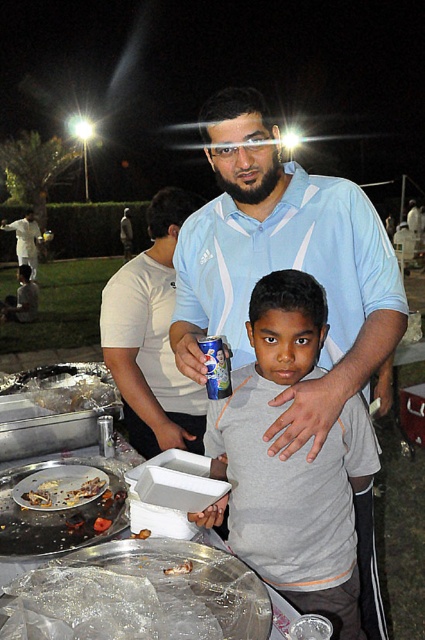
Question: Based on their relative distances, which object is farther from the gray matte shirt at center?

Choices:
 (A) matte white shirt at center
 (B) matte black laptop at left

Answer: (B)

Question: Which of these objects is positioned closest to the matte white shirt at center?

Choices:
 (A) matte black laptop at left
 (B) brown crispy chicken at lower left
 (C) gray matte shirt at center

Answer: (B)

Question: Where is gray matte shirt at center located in relation to matte white shirt at center in the image?

Choices:
 (A) left
 (B) right

Answer: (B)

Question: Which object is the farthest from the brown crispy chicken at lower left?

Choices:
 (A) matte black laptop at left
 (B) matte white shirt at center

Answer: (A)

Question: Is matte white shirt at center bigger than brown crispy chicken at lower left?

Choices:
 (A) no
 (B) yes

Answer: (B)

Question: Observing the image, what is the correct spatial positioning of gray matte shirt at center in reference to brown crispy chicken at lower left?

Choices:
 (A) left
 (B) right

Answer: (B)